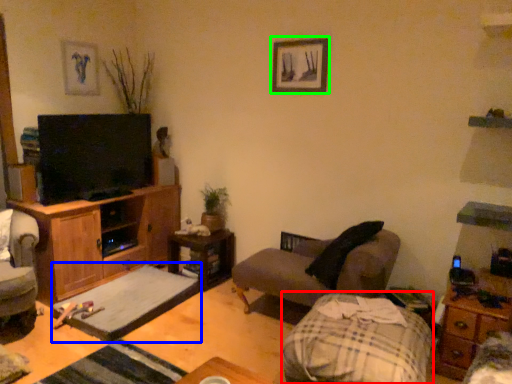
Question: Which object is positioned farthest from flat (highlighted by a red box)? Select from footrest (highlighted by a blue box) and picture frame (highlighted by a green box).

Choices:
 (A) footrest
 (B) picture frame

Answer: (B)